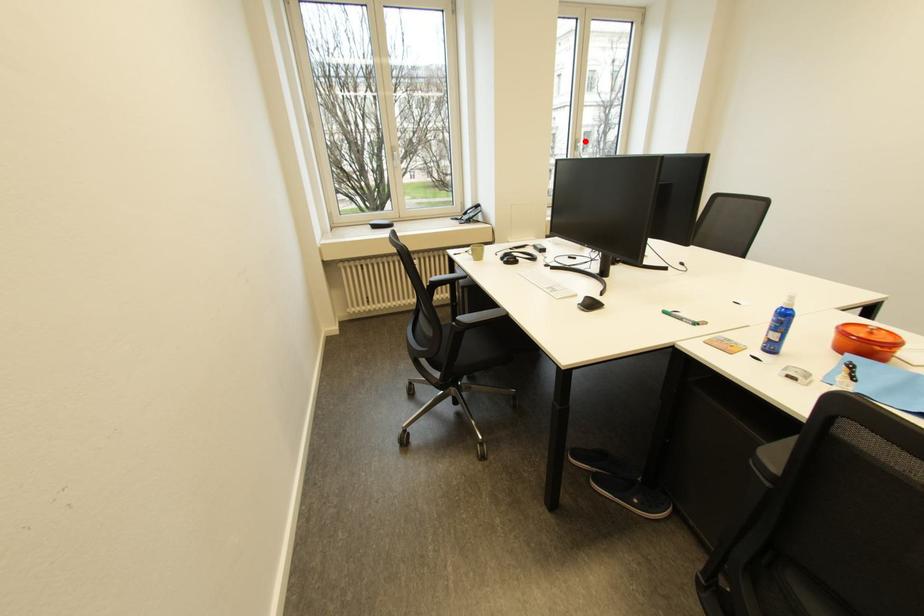
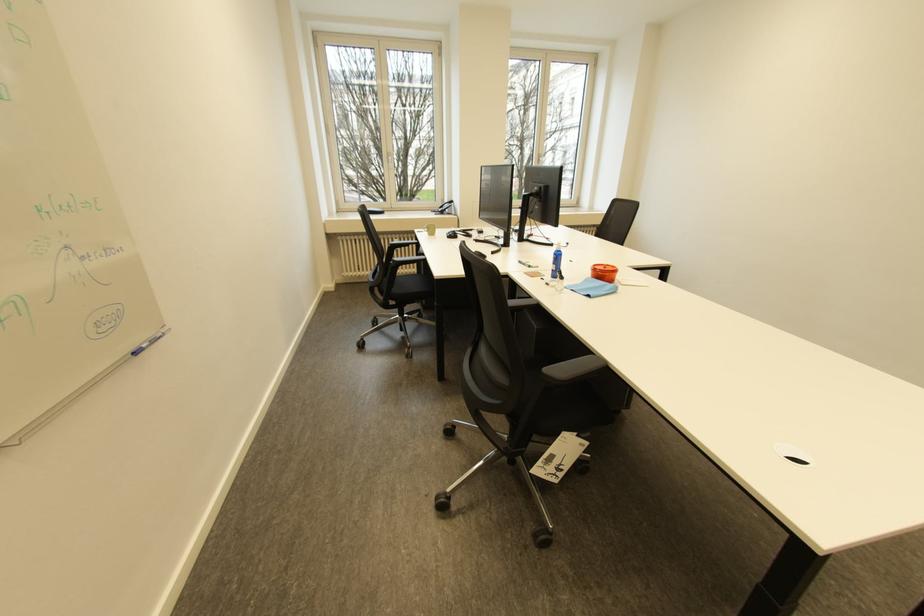
Question: I am providing you with two images of the same scene from different viewpoints. A red point is marked on the first image. Can you still see the location of the red point in image 2?

Choices:
 (A) Yes
 (B) No

Answer: (A)